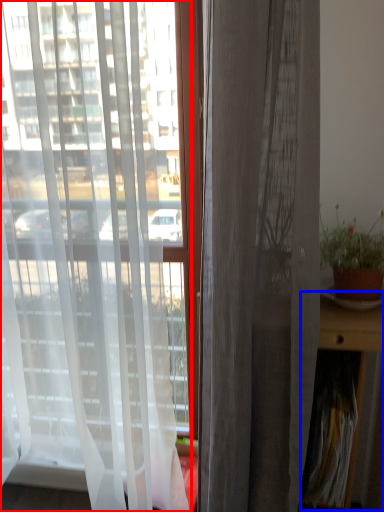
Question: Which object is closer to the camera taking this photo, curtain (highlighted by a red box) or table (highlighted by a blue box)?

Choices:
 (A) curtain
 (B) table

Answer: (A)